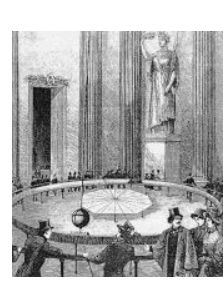
Locate an element on the screen. The image size is (223, 303). lamp is located at coordinates (86, 221).